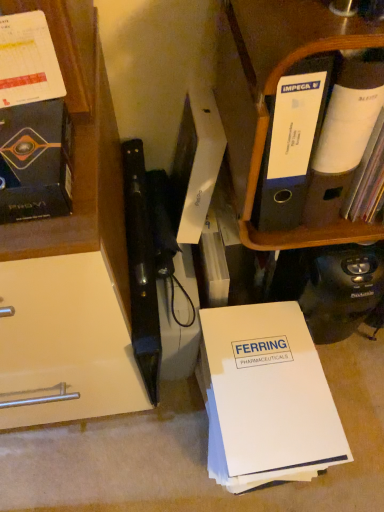
Question: Can you confirm if black plastic folder at upper right is wider than white paper at center?

Choices:
 (A) yes
 (B) no

Answer: (B)

Question: Can you confirm if black plastic folder at upper right is bigger than white paper at center?

Choices:
 (A) yes
 (B) no

Answer: (B)

Question: Is white paper at center located within black plastic folder at upper right?

Choices:
 (A) yes
 (B) no

Answer: (B)

Question: Is black plastic folder at upper right at the left side of white paper at center?

Choices:
 (A) yes
 (B) no

Answer: (B)

Question: Does black plastic folder at upper right touch white paper at center?

Choices:
 (A) yes
 (B) no

Answer: (B)

Question: Is black plastic folder at upper right not near white paper at center?

Choices:
 (A) no
 (B) yes

Answer: (A)

Question: Is matte black book at left not within white paper at center?

Choices:
 (A) no
 (B) yes

Answer: (B)

Question: Does matte black book at left have a larger size compared to white paper at center?

Choices:
 (A) yes
 (B) no

Answer: (B)

Question: Could you tell me if matte black book at left is facing white paper at center?

Choices:
 (A) yes
 (B) no

Answer: (B)

Question: Would you say matte black book at left contains white paper at center?

Choices:
 (A) yes
 (B) no

Answer: (B)

Question: Is matte black book at left at the left side of white paper at center?

Choices:
 (A) no
 (B) yes

Answer: (B)

Question: Can you confirm if matte black book at left is taller than white paper at center?

Choices:
 (A) yes
 (B) no

Answer: (B)

Question: Does white paper at center have a greater width compared to black plastic folder at upper right?

Choices:
 (A) yes
 (B) no

Answer: (A)